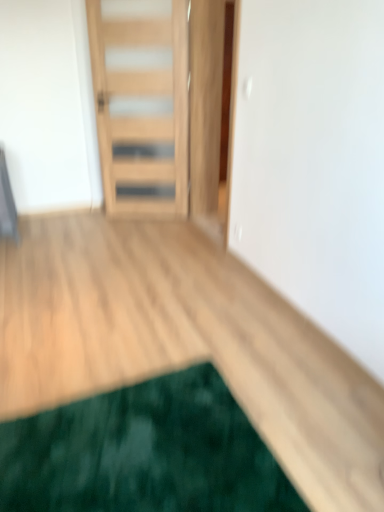
The width and height of the screenshot is (384, 512). Find the location of `free space to the right of green plush mat at lower left`. free space to the right of green plush mat at lower left is located at coordinates (312, 411).